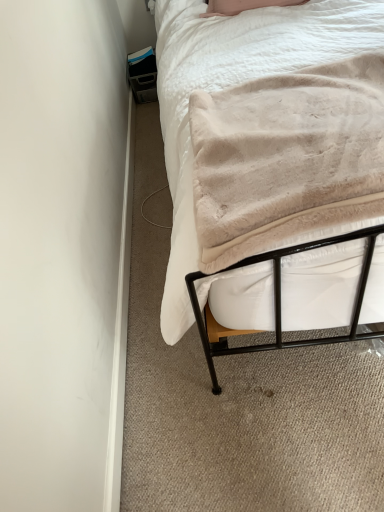
Question: From their relative heights in the image, would you say beige plush blanket at center is taller or shorter than beige plush blanket at upper right?

Choices:
 (A) short
 (B) tall

Answer: (B)

Question: Is point (233, 113) positioned closer to the camera than point (339, 94)?

Choices:
 (A) closer
 (B) farther

Answer: (B)

Question: Which is correct: beige plush blanket at center is inside beige plush blanket at upper right, or outside of it?

Choices:
 (A) outside
 (B) inside

Answer: (A)

Question: Is point (286, 66) closer or farther from the camera than point (231, 225)?

Choices:
 (A) farther
 (B) closer

Answer: (A)

Question: Is beige plush blanket at upper right inside or outside of beige plush blanket at center?

Choices:
 (A) outside
 (B) inside

Answer: (A)

Question: Considering the positions of beige plush blanket at upper right and beige plush blanket at center in the image, is beige plush blanket at upper right taller or shorter than beige plush blanket at center?

Choices:
 (A) tall
 (B) short

Answer: (B)

Question: In the image, is beige plush blanket at upper right positioned in front of or behind beige plush blanket at center?

Choices:
 (A) behind
 (B) front

Answer: (A)